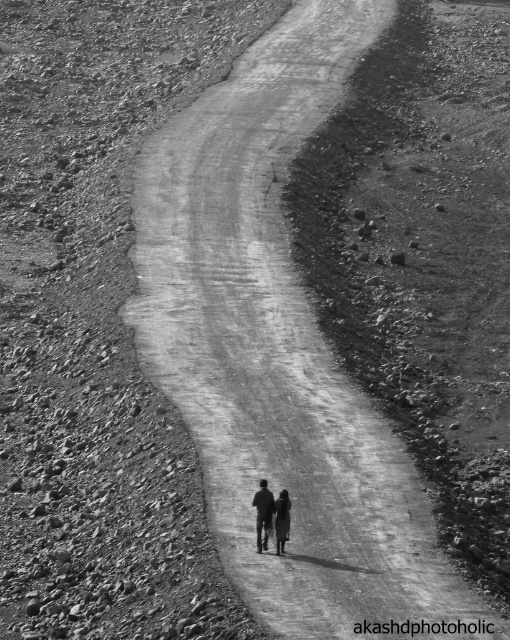
Question: Does silhouette figure at center have a smaller size compared to dark fabric figure at center?

Choices:
 (A) yes
 (B) no

Answer: (B)

Question: Is silhouette figure at center further to camera compared to dark fabric figure at center?

Choices:
 (A) no
 (B) yes

Answer: (B)

Question: Which object is closer to the camera taking this photo?

Choices:
 (A) dark fabric figure at center
 (B) silhouette figure at center

Answer: (A)

Question: Does silhouette figure at center have a lesser width compared to dark fabric figure at center?

Choices:
 (A) yes
 (B) no

Answer: (B)